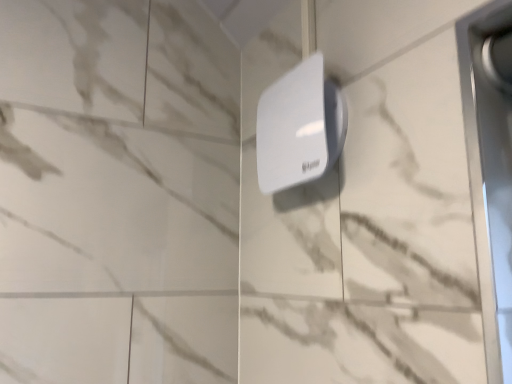
Measure the distance between point (263, 121) and camera.

Point (263, 121) is 26.97 inches from camera.

The image size is (512, 384). Identify the location of white matte air freshener at center. (298, 127).

Describe the element at coordinates (298, 127) in the screenshot. The height and width of the screenshot is (384, 512). I see `white matte air freshener at center` at that location.

I want to click on white matte air freshener at center, so click(x=298, y=127).